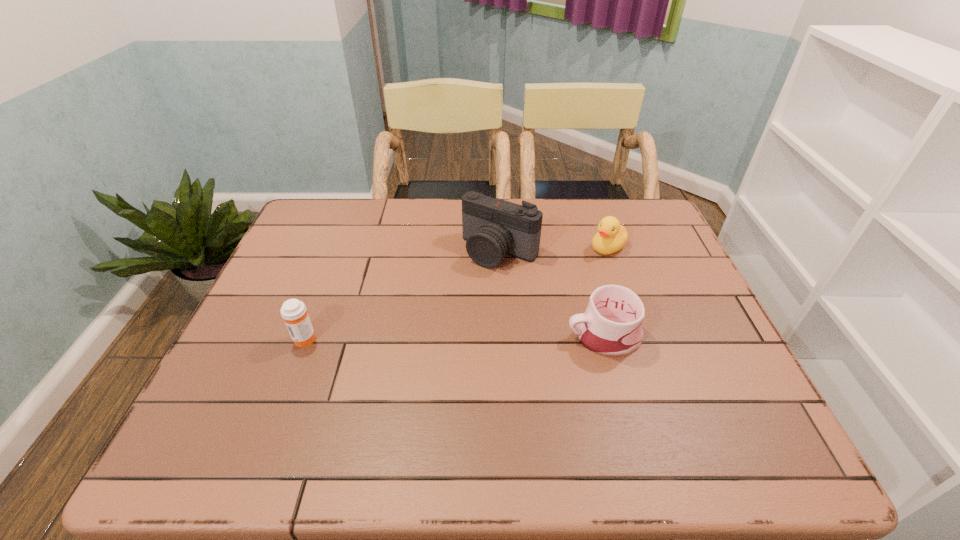
In the image, there is a desktop. Where is `vacant space at the far edge`? The height and width of the screenshot is (540, 960). vacant space at the far edge is located at coordinates (592, 218).

You are a GUI agent. You are given a task and a screenshot of the screen. Output one action in this format:
    pyautogui.click(x=<x>, y=<y>)
    Task: Click on the free region at the near edge of the desktop
    The image size is (960, 540).
    Given the screenshot: What is the action you would take?
    pyautogui.click(x=530, y=384)

Image resolution: width=960 pixels, height=540 pixels. Find the location of `vacant space at the left edge`. vacant space at the left edge is located at coordinates (292, 360).

The image size is (960, 540). In the image, there is a desktop. Find the location of `vacant area at the right edge`. vacant area at the right edge is located at coordinates (668, 360).

Image resolution: width=960 pixels, height=540 pixels. I want to click on vacant position at the far left corner of the desktop, so click(x=341, y=227).

In order to click on free space at the far right corner of the desktop in this screenshot , I will do `click(656, 238)`.

Where is `free space between the duckling and the second object from left to right`? This screenshot has height=540, width=960. free space between the duckling and the second object from left to right is located at coordinates (554, 249).

The image size is (960, 540). I want to click on free space between the camera and the leftmost object, so click(402, 295).

Where is `vacant space that's between the tallest object and the mug`? This screenshot has width=960, height=540. vacant space that's between the tallest object and the mug is located at coordinates (552, 293).

Locate an element on the screen. The height and width of the screenshot is (540, 960). blank region between the tallest object and the mug is located at coordinates (552, 293).